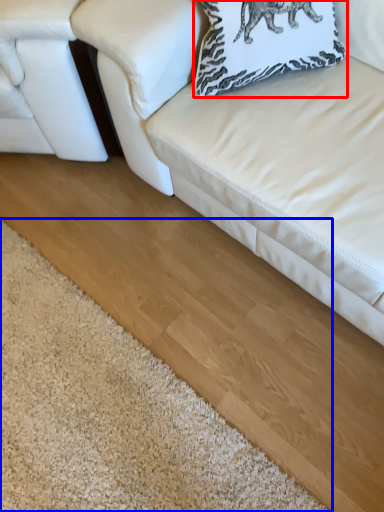
Question: Which object appears closest to the camera in this image, pillow (highlighted by a red box) or mat (highlighted by a blue box)?

Choices:
 (A) pillow
 (B) mat

Answer: (B)